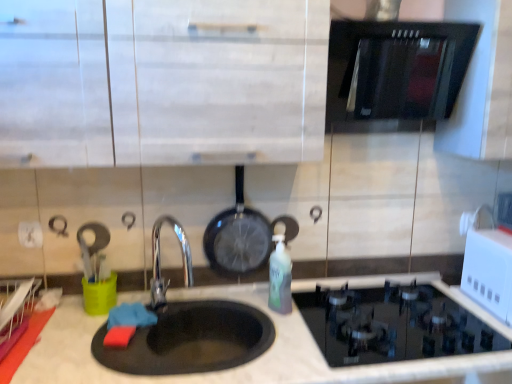
Question: Is black glass oven at upper right thinner than white glossy microwave at upper right?

Choices:
 (A) yes
 (B) no

Answer: (B)

Question: Can you confirm if black glass oven at upper right is shorter than white glossy microwave at upper right?

Choices:
 (A) yes
 (B) no

Answer: (B)

Question: Can you confirm if black glass oven at upper right is taller than white glossy microwave at upper right?

Choices:
 (A) no
 (B) yes

Answer: (B)

Question: Is white glossy microwave at upper right at the back of black glass oven at upper right?

Choices:
 (A) no
 (B) yes

Answer: (A)

Question: From a real-world perspective, is black glass oven at upper right beneath white glossy microwave at upper right?

Choices:
 (A) no
 (B) yes

Answer: (A)

Question: In terms of height, does black matte pizza pan at lower center look taller or shorter compared to white matte cabinet at upper center?

Choices:
 (A) tall
 (B) short

Answer: (B)

Question: Is black matte pizza pan at lower center bigger or smaller than white matte cabinet at upper center?

Choices:
 (A) small
 (B) big

Answer: (A)

Question: Is black matte pizza pan at lower center inside or outside of white matte cabinet at upper center?

Choices:
 (A) outside
 (B) inside

Answer: (A)

Question: Does point (207, 339) appear closer or farther from the camera than point (217, 107)?

Choices:
 (A) farther
 (B) closer

Answer: (A)

Question: Is white glossy microwave at upper right in front of or behind black matte pizza pan at lower center in the image?

Choices:
 (A) behind
 (B) front

Answer: (A)

Question: From their relative heights in the image, would you say white glossy microwave at upper right is taller or shorter than black matte pizza pan at lower center?

Choices:
 (A) tall
 (B) short

Answer: (A)

Question: Is white glossy microwave at upper right wider or thinner than black matte pizza pan at lower center?

Choices:
 (A) wide
 (B) thin

Answer: (B)

Question: From a real-world perspective, is white glossy microwave at upper right physically located above or below black matte pizza pan at lower center?

Choices:
 (A) below
 (B) above

Answer: (B)

Question: From a real-world perspective, relative to white glossy microwave at upper right, is translucent green bottle at center vertically above or below?

Choices:
 (A) below
 (B) above

Answer: (A)

Question: Would you say translucent green bottle at center is to the left or to the right of white glossy microwave at upper right in the picture?

Choices:
 (A) right
 (B) left

Answer: (B)